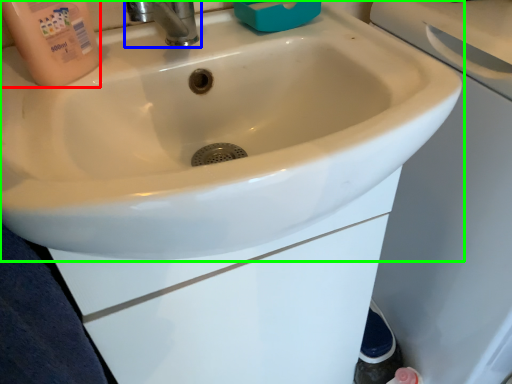
Question: Which is nearer to the cleaning product (highlighted by a red box)? tap (highlighted by a blue box) or sink (highlighted by a green box).

Choices:
 (A) tap
 (B) sink

Answer: (A)